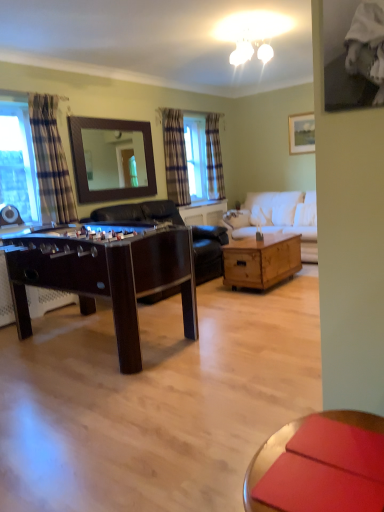
Question: In which direction should I rotate to look at plaid fabric curtain at center, which is the third curtain from front to back?

Choices:
 (A) right
 (B) left

Answer: (A)

Question: Considering the relative positions of dark brown leather futon at center and clear glass window at left in the image provided, is dark brown leather futon at center to the left of clear glass window at left from the viewer's perspective?

Choices:
 (A) yes
 (B) no

Answer: (B)

Question: Is dark brown leather futon at center not inside clear glass window at left?

Choices:
 (A) no
 (B) yes

Answer: (B)

Question: Considering the relative positions of dark brown leather futon at center and clear glass window at left in the image provided, is dark brown leather futon at center to the right of clear glass window at left from the viewer's perspective?

Choices:
 (A) no
 (B) yes

Answer: (B)

Question: From a real-world perspective, is dark brown leather futon at center physically below clear glass window at left?

Choices:
 (A) no
 (B) yes

Answer: (B)

Question: Is clear glass window at left inside dark brown leather futon at center?

Choices:
 (A) no
 (B) yes

Answer: (A)

Question: Can you confirm if dark brown leather futon at center is shorter than clear glass window at left?

Choices:
 (A) yes
 (B) no

Answer: (A)

Question: From the image's perspective, is dark wood foosball table at center, the first table when ordered from front to back, over smooth wooden coffee table at lower right?

Choices:
 (A) yes
 (B) no

Answer: (A)

Question: Is dark wood foosball table at center, the first table when ordered from front to back, closer to the viewer compared to smooth wooden coffee table at lower right?

Choices:
 (A) no
 (B) yes

Answer: (A)

Question: Could you tell me if dark wood foosball table at center, positioned as the 2th table in back-to-front order, is turned towards smooth wooden coffee table at lower right?

Choices:
 (A) no
 (B) yes

Answer: (A)

Question: Does dark wood foosball table at center, which appears as the first table when viewed from the left, appear on the left side of smooth wooden coffee table at lower right?

Choices:
 (A) no
 (B) yes

Answer: (B)

Question: Is dark wood foosball table at center, which appears as the first table when viewed from the left, further to the viewer compared to smooth wooden coffee table at lower right?

Choices:
 (A) no
 (B) yes

Answer: (B)

Question: Is dark wood foosball table at center, the first table when ordered from front to back, shorter than smooth wooden coffee table at lower right?

Choices:
 (A) yes
 (B) no

Answer: (B)

Question: Is plaid fabric curtain at center, which is the 1th curtain in back-to-front order, a part of wooden framed mirror at upper center?

Choices:
 (A) no
 (B) yes

Answer: (A)